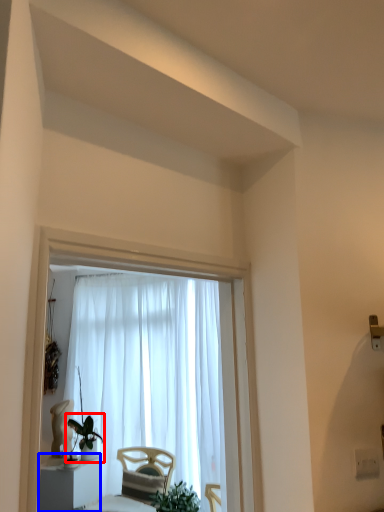
Question: Which object is further to the camera taking this photo, houseplant (highlighted by a red box) or furniture (highlighted by a blue box)?

Choices:
 (A) houseplant
 (B) furniture

Answer: (A)